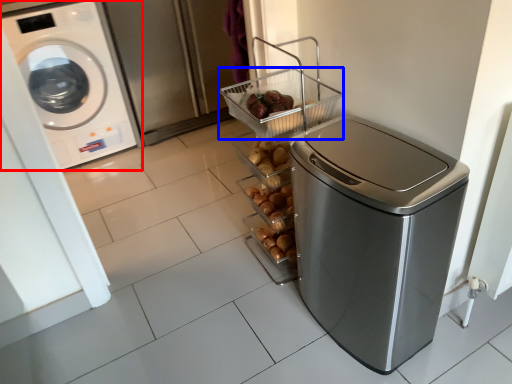
Question: Which of the following is the closest to the observer, washing machine (highlighted by a red box) or basket (highlighted by a blue box)?

Choices:
 (A) washing machine
 (B) basket

Answer: (B)